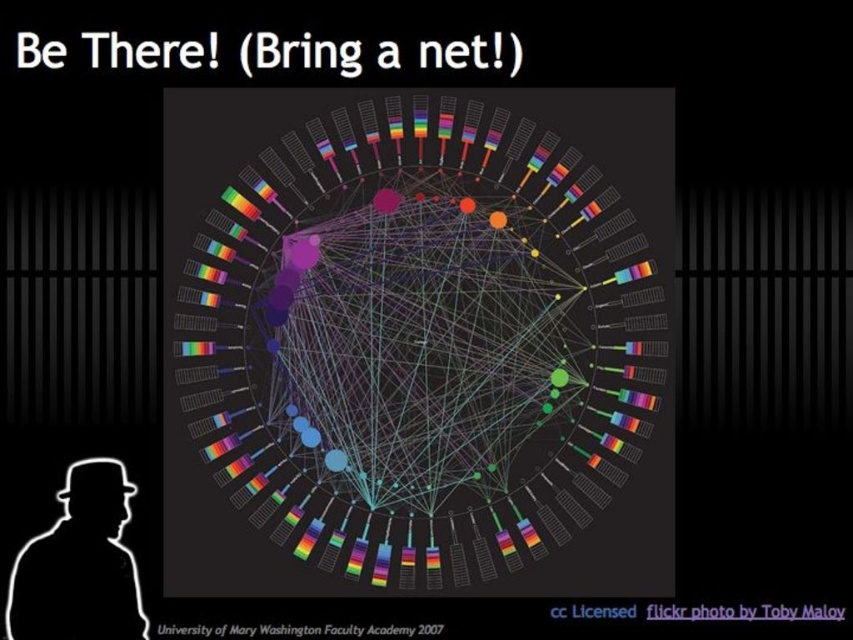
You are an art student analyzing the image. You want to determine which object is closer to you. Which is closer between the rainbow plastic network at center and the white matte silhouette at lower left?

The rainbow plastic network at center is closer to you than the white matte silhouette at lower left because it is further to the viewer.

You are an artist analyzing the image. You see the point at coordinates (x=418, y=339). Is this point part of the rainbow plastic network at center?

Yes, the point at coordinates (x=418, y=339) is part of the rainbow plastic network at center.

You are an artist analyzing a digital artwork. You see the rainbow plastic network at center and the white matte silhouette at lower left. Based on their positions, which one is located higher in the image?

The rainbow plastic network at center is above the white matte silhouette at lower left, so it is located higher in the image.